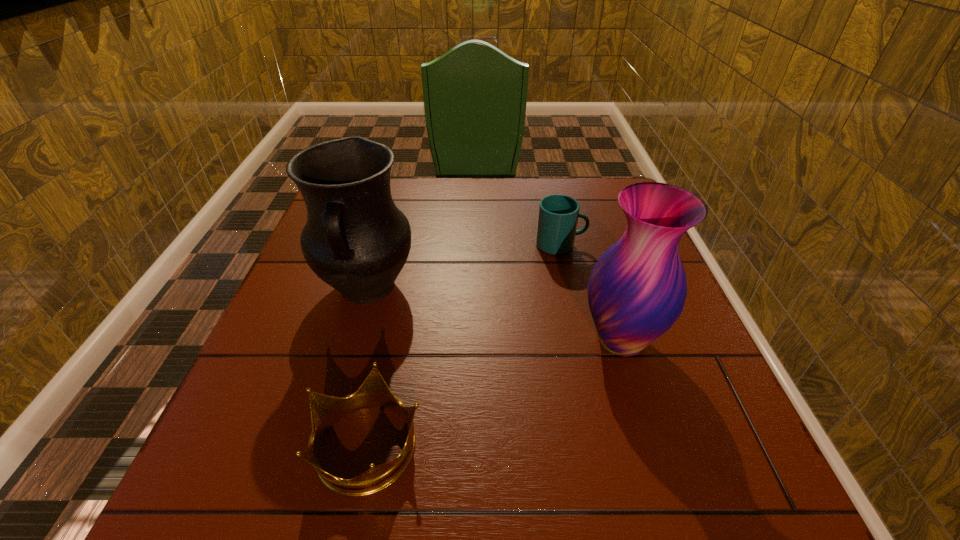
Locate an element on the screen. The image size is (960, 540). empty space between the vase and the pitcher is located at coordinates (493, 314).

You are a GUI agent. You are given a task and a screenshot of the screen. Output one action in this format:
    pyautogui.click(x=<x>, y=<y>)
    Task: Click on the empty space between the crown and the vase
    Image resolution: width=960 pixels, height=540 pixels.
    Given the screenshot: What is the action you would take?
    pyautogui.click(x=494, y=392)

Where is `vacant area that lies between the shortest object and the vase`? This screenshot has height=540, width=960. vacant area that lies between the shortest object and the vase is located at coordinates (494, 392).

Where is `unoccupied area between the cup and the shortest object`? unoccupied area between the cup and the shortest object is located at coordinates (465, 345).

Locate an element on the screen. This screenshot has height=540, width=960. unoccupied position between the vase and the pitcher is located at coordinates (493, 314).

Where is `object that is the closest to the pitcher`? The width and height of the screenshot is (960, 540). object that is the closest to the pitcher is located at coordinates (325, 410).

Locate which object ranks second in proximity to the pitcher. Please provide its 2D coordinates. Your answer should be formatted as a tuple, i.e. [(x, y)], where the tuple contains the x and y coordinates of a point satisfying the conditions above.

[(558, 214)]

Locate an element on the screen. The width and height of the screenshot is (960, 540). blank space that satisfies the following two spatial constraints: 1. on the handle side of the pitcher; 2. on the left side of the vase is located at coordinates (352, 340).

Where is `vacant region that satisfies the following two spatial constraints: 1. on the handle side of the cup; 2. on the handle side of the pitcher`? This screenshot has height=540, width=960. vacant region that satisfies the following two spatial constraints: 1. on the handle side of the cup; 2. on the handle side of the pitcher is located at coordinates (570, 288).

I want to click on free location that satisfies the following two spatial constraints: 1. on the handle side of the pitcher; 2. on the left side of the crown, so click(x=323, y=444).